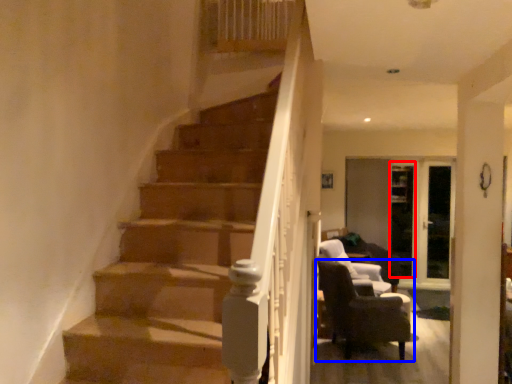
Question: Which object appears farthest to the camera in this image, glass door (highlighted by a red box) or chair (highlighted by a blue box)?

Choices:
 (A) glass door
 (B) chair

Answer: (A)